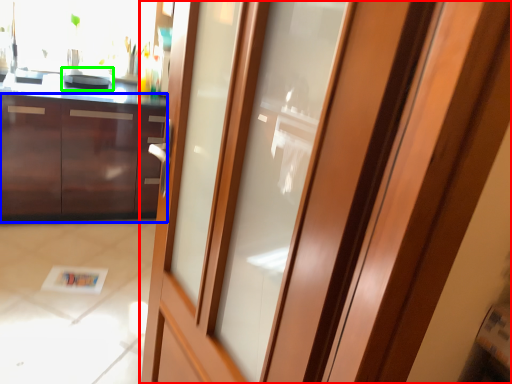
Question: Estimate the real-world distances between objects in this image. Which object is closer to door (highlighted by a red box), cabinetry (highlighted by a blue box) or appliance (highlighted by a green box)?

Choices:
 (A) cabinetry
 (B) appliance

Answer: (A)